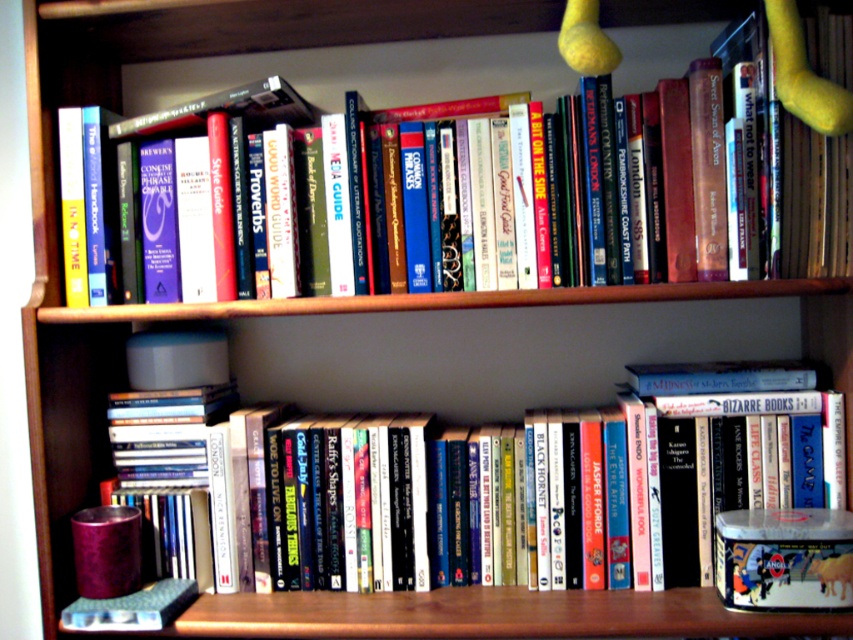
Question: Is hardcover book at lower center further to camera compared to hardcover book at upper center?

Choices:
 (A) no
 (B) yes

Answer: (A)

Question: Which point appears closest to the camera in this image?

Choices:
 (A) (67, 100)
 (B) (306, 488)

Answer: (B)

Question: Which point appears closest to the camera in this image?

Choices:
 (A) (158, 58)
 (B) (633, 465)

Answer: (B)

Question: Is hardcover book at lower center behind hardcover book at upper center?

Choices:
 (A) yes
 (B) no

Answer: (B)

Question: Is hardcover book at lower center bigger than hardcover book at upper center?

Choices:
 (A) no
 (B) yes

Answer: (A)